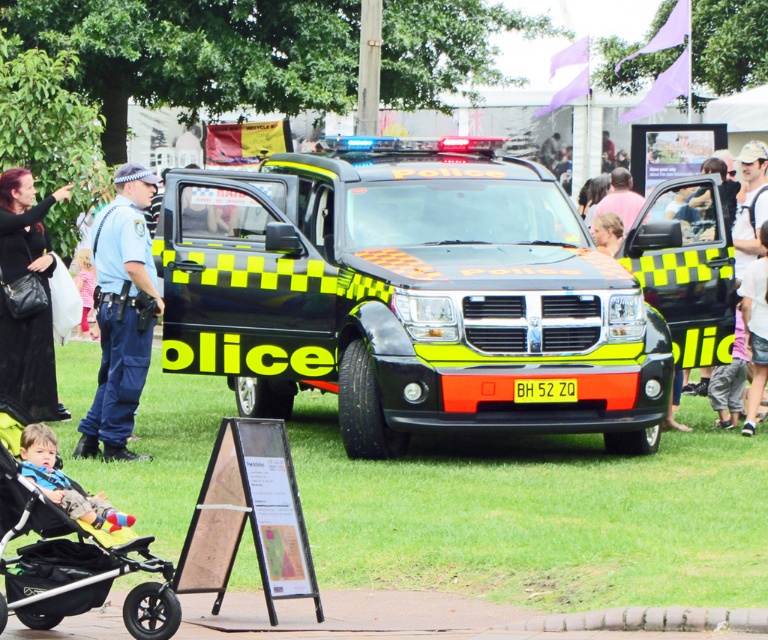
Is neon yellow/green checkered police vehicle at center positioned in front of black plastic baby carriage at lower left?

No, it is not.

Is point (366, 241) behind point (98, 580)?

Yes, it is.

Find the location of a particular element. The height and width of the screenshot is (640, 768). neon yellow/green checkered police vehicle at center is located at coordinates (406, 296).

Can you confirm if neon yellow/green checkered police vehicle at center is positioned to the right of blue uniformed officer at left?

Yes, neon yellow/green checkered police vehicle at center is to the right of blue uniformed officer at left.

Is point (386, 292) closer to viewer compared to point (104, 428)?

Yes, point (386, 292) is in front of point (104, 428).

Where is `neon yellow/green checkered police vehicle at center`? neon yellow/green checkered police vehicle at center is located at coordinates (406, 296).

Can you confirm if blue uniformed officer at left is bigger than black leather handbag at left?

Yes.

Which of these two, blue uniformed officer at left or black leather handbag at left, stands taller?

blue uniformed officer at left

Between point (144, 310) and point (42, 314), which one is positioned in front?

Point (144, 310) is more forward.

Locate an element on the screen. blue uniformed officer at left is located at coordinates (121, 314).